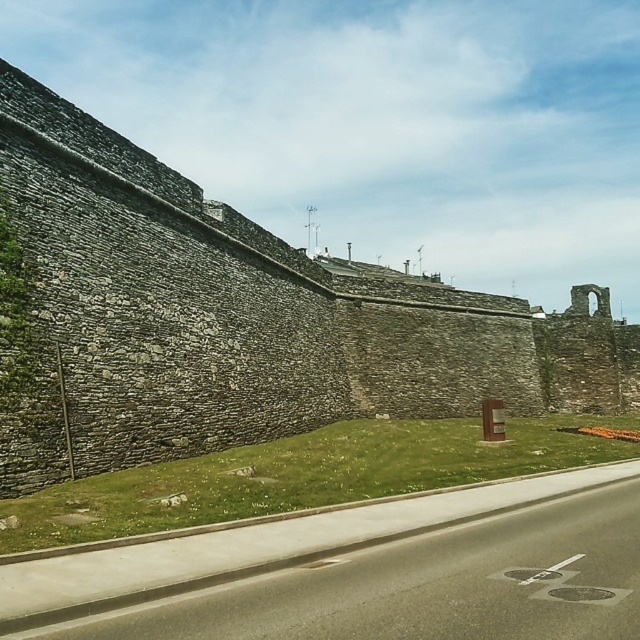
Does gray stone wall at center appear on the left side of green grass at lower center?

In fact, gray stone wall at center is to the right of green grass at lower center.

Is gray stone wall at center wider than green grass at lower center?

Yes.

Where is `gray stone wall at center`? This screenshot has width=640, height=640. gray stone wall at center is located at coordinates click(243, 317).

At what (x,y) coordinates should I click in order to perform the action: click on gray stone wall at center. Please return your answer as a coordinate pair (x, y). This screenshot has height=640, width=640. Looking at the image, I should click on (243, 317).

Is asphalt road at lower center wider than green grass at lower center?

No, asphalt road at lower center is not wider than green grass at lower center.

Is asphalt road at lower center further to camera compared to green grass at lower center?

That is False.

Which is in front, point (488, 634) or point (1, 541)?

Positioned in front is point (488, 634).

Find the location of `asphalt road at lower center`. asphalt road at lower center is located at coordinates (365, 573).

Is point (419, 285) in front of point (403, 577)?

No, it is not.

Can you confirm if gray stone wall at center is positioned below asphalt road at lower center?

No, gray stone wall at center is not below asphalt road at lower center.

Is point (604, 291) positioned after point (170, 541)?

That is True.

Locate an element on the screen. Image resolution: width=640 pixels, height=640 pixels. gray stone wall at center is located at coordinates (243, 317).